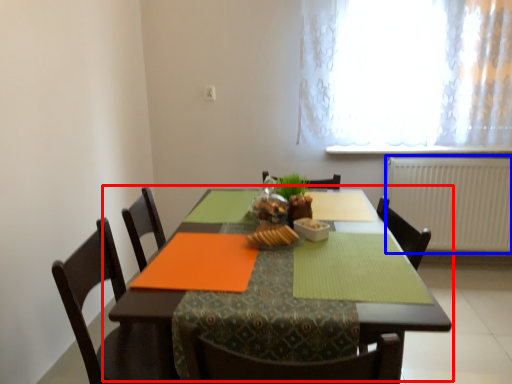
Question: Which object is further to the camera taking this photo, table (highlighted by a red box) or radiator (highlighted by a blue box)?

Choices:
 (A) table
 (B) radiator

Answer: (B)